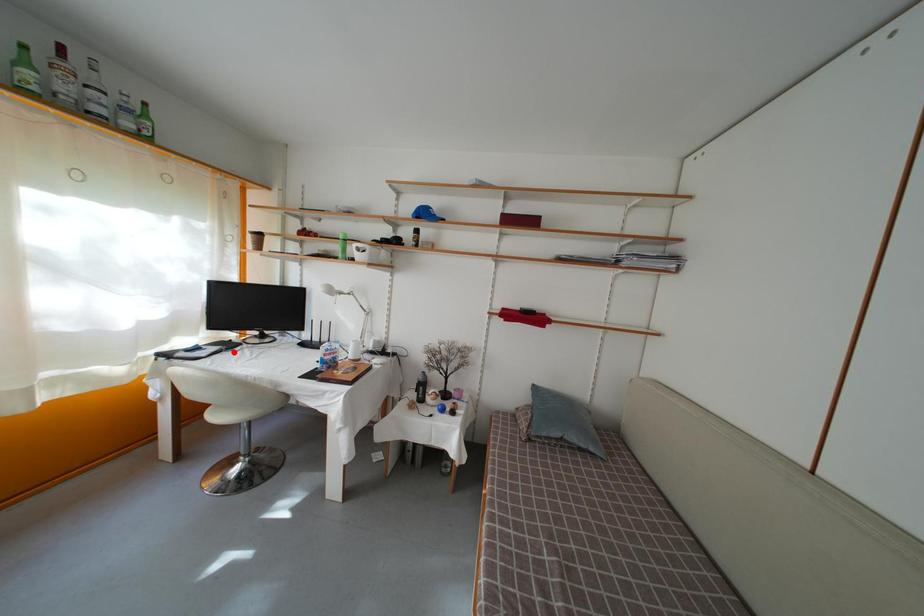
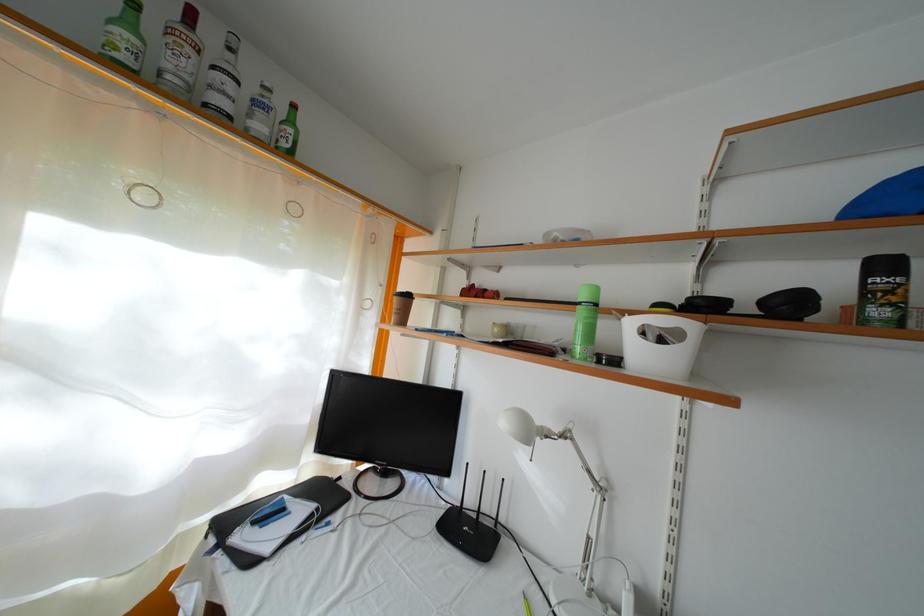
In the second image, find the point that corresponds to the highlighted location in the first image.

(334, 506)